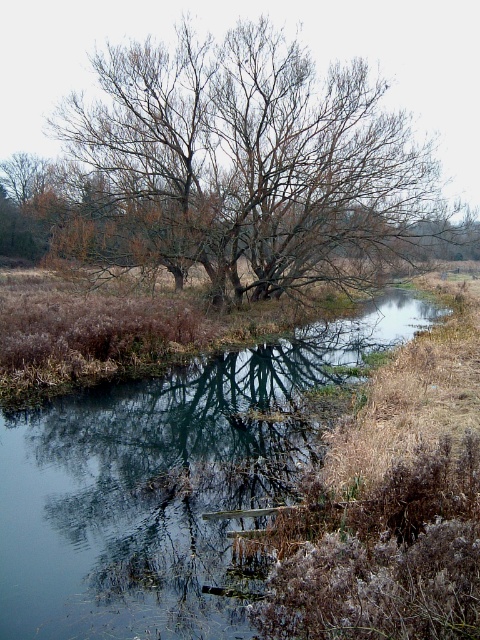
Does smooth reflective water at center have a larger size compared to bare branches tree at center?

No, smooth reflective water at center is not bigger than bare branches tree at center.

Is smooth reflective water at center taller than bare branches tree at center?

No.

At what (x,y) coordinates should I click in order to perform the action: click on smooth reflective water at center. Please return your answer as a coordinate pair (x, y). The image size is (480, 640). Looking at the image, I should click on (164, 484).